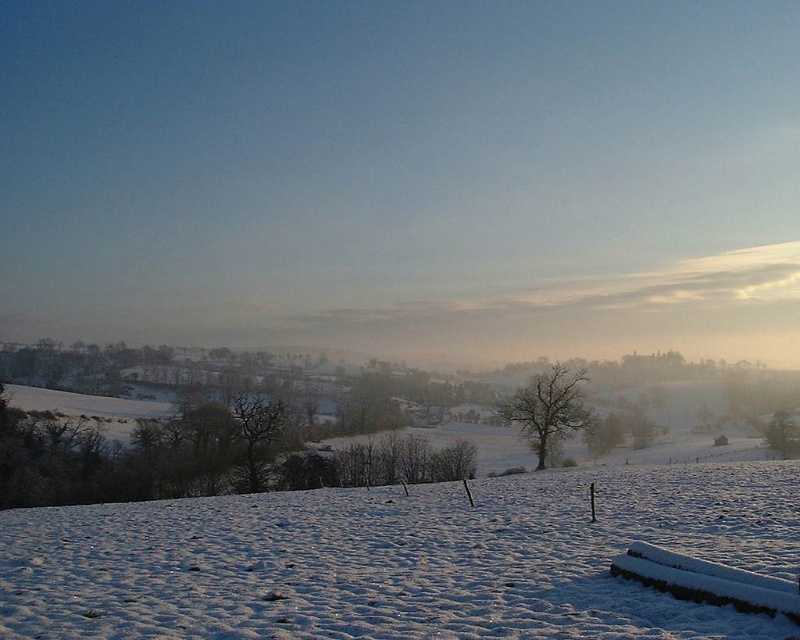
You are an observer standing on the hill and looking at the scene. Which tree is located to the right of the other between the bare tree at center and the dark brown textured tree at center?

The bare tree at center is positioned on the right side of the dark brown textured tree at center.

You are standing in the winter landscape and want to take a photo of the white fluffy snow at center and the bare tree at center. Which object will appear larger in your photo?

The white fluffy snow at center will appear larger in the photo because it is closer to the viewer than the bare tree at center.